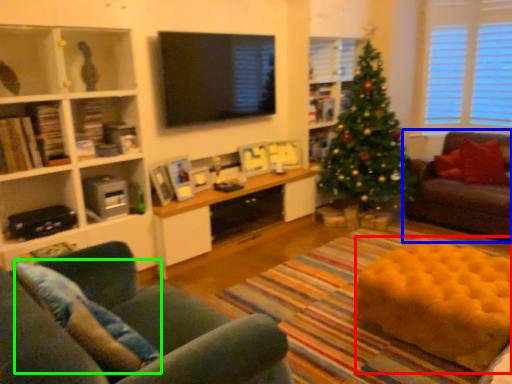
Question: Estimate the real-world distances between objects in this image. Which object is farther from flat (highlighted by a red box), studio couch (highlighted by a blue box) or pillow (highlighted by a green box)?

Choices:
 (A) studio couch
 (B) pillow

Answer: (B)